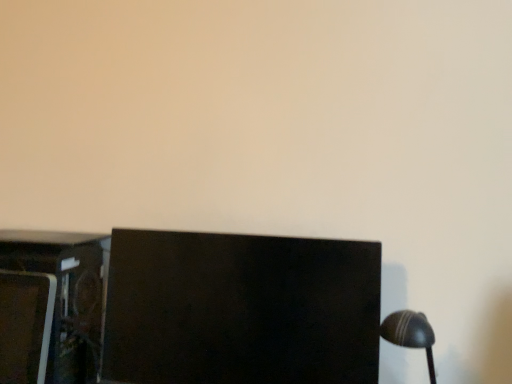
Question: Does metallic dark brown cabinet at lower left lie in front of black glossy monitor at center?

Choices:
 (A) no
 (B) yes

Answer: (A)

Question: Is metallic dark brown cabinet at lower left to the left of black glossy monitor at center from the viewer's perspective?

Choices:
 (A) yes
 (B) no

Answer: (A)

Question: Is metallic dark brown cabinet at lower left bigger than black glossy monitor at center?

Choices:
 (A) yes
 (B) no

Answer: (B)

Question: Considering the relative sizes of metallic dark brown cabinet at lower left and black glossy monitor at center in the image provided, is metallic dark brown cabinet at lower left smaller than black glossy monitor at center?

Choices:
 (A) no
 (B) yes

Answer: (B)

Question: Can you confirm if metallic dark brown cabinet at lower left is positioned to the right of black glossy monitor at center?

Choices:
 (A) yes
 (B) no

Answer: (B)

Question: Does metallic dark brown cabinet at lower left have a greater height compared to black glossy monitor at center?

Choices:
 (A) yes
 (B) no

Answer: (A)

Question: Is black glossy monitor at center oriented away from metallic dark brown cabinet at lower left?

Choices:
 (A) no
 (B) yes

Answer: (A)

Question: Is black glossy monitor at center positioned far away from metallic dark brown cabinet at lower left?

Choices:
 (A) yes
 (B) no

Answer: (B)

Question: Is the position of black glossy monitor at center more distant than that of metallic dark brown cabinet at lower left?

Choices:
 (A) yes
 (B) no

Answer: (B)

Question: Does black glossy monitor at center appear on the left side of metallic dark brown cabinet at lower left?

Choices:
 (A) yes
 (B) no

Answer: (B)

Question: Is black glossy monitor at center closer to the viewer compared to metallic dark brown cabinet at lower left?

Choices:
 (A) no
 (B) yes

Answer: (B)

Question: Is black glossy monitor at center thinner than metallic dark brown cabinet at lower left?

Choices:
 (A) no
 (B) yes

Answer: (B)

Question: In terms of height, does metallic dark brown cabinet at lower left look taller or shorter compared to black glossy monitor at center?

Choices:
 (A) tall
 (B) short

Answer: (A)